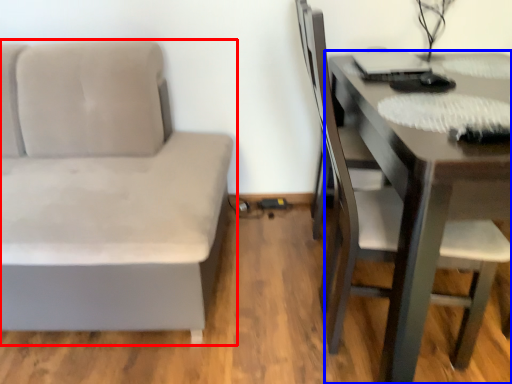
Question: Among these objects, which one is farthest to the camera, studio couch (highlighted by a red box) or table (highlighted by a blue box)?

Choices:
 (A) studio couch
 (B) table

Answer: (A)